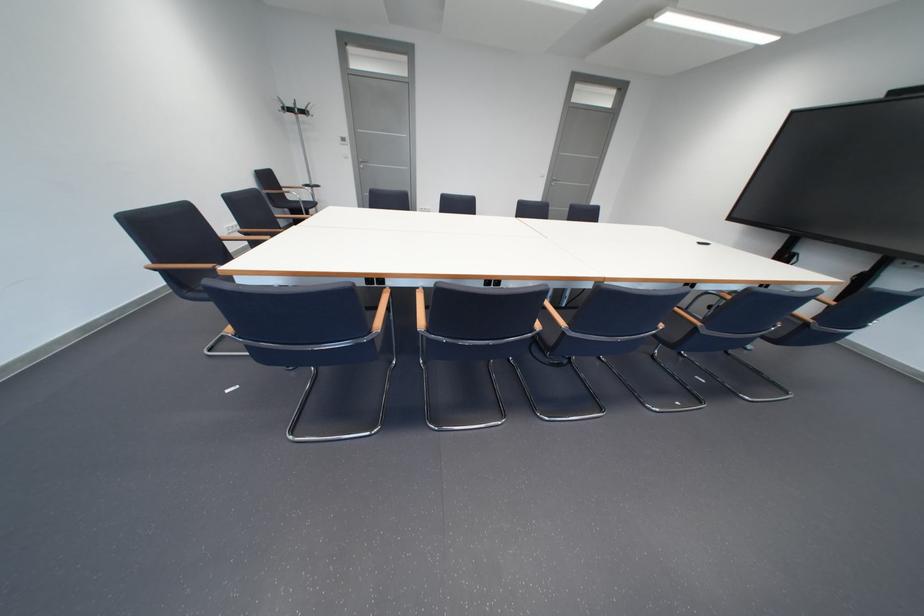
Image resolution: width=924 pixels, height=616 pixels. What are the coordinates of `wooden chair armrest` in the screenshot? It's located at (381, 312).